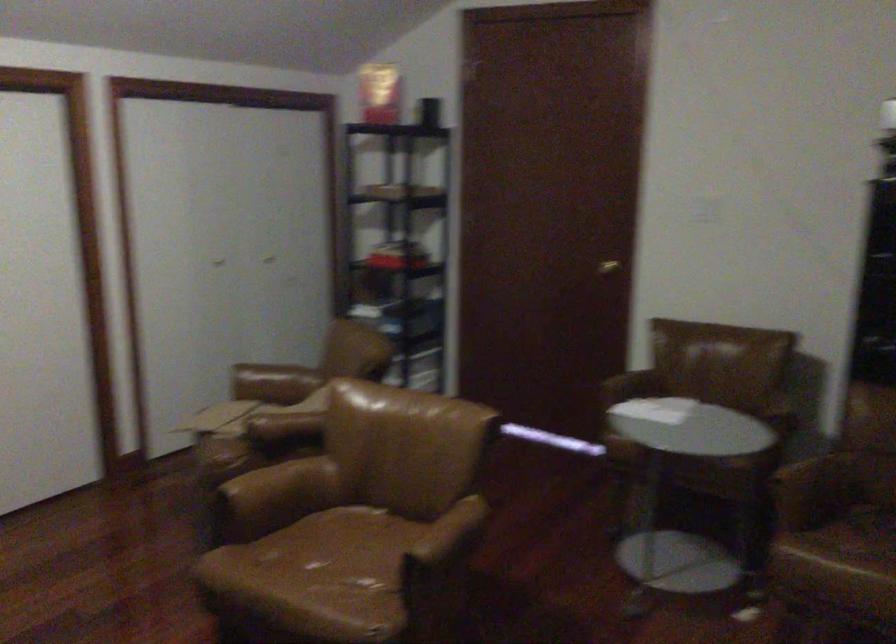
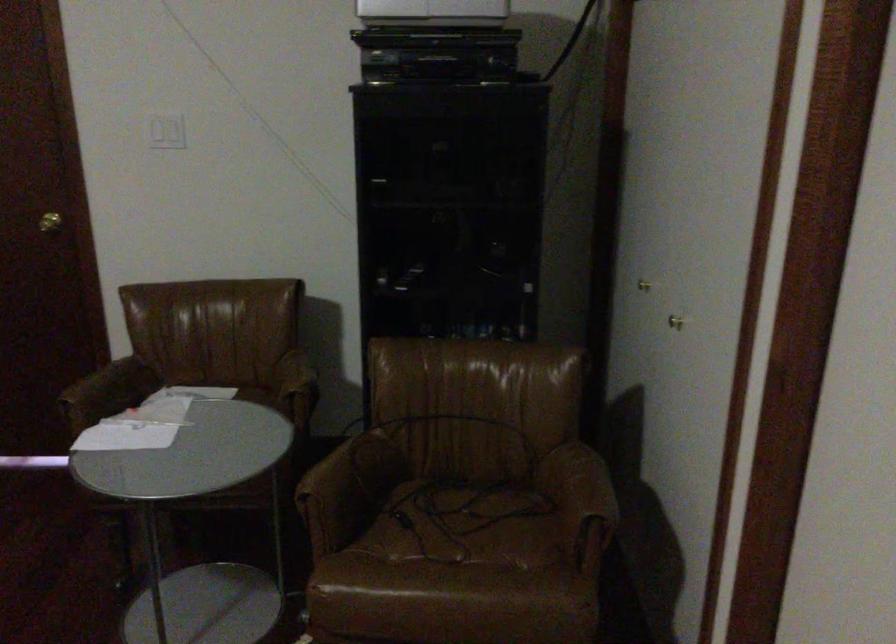
In the second image, find the point that corresponds to point (617, 263) in the first image.

(49, 222)